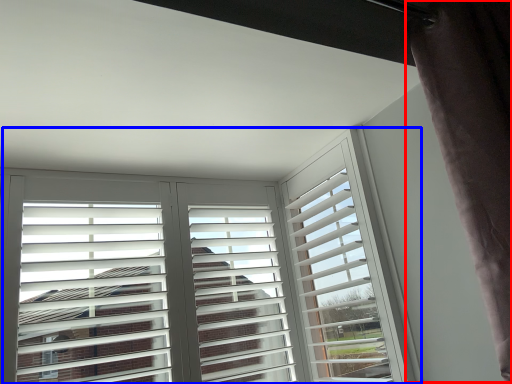
Question: Which object is closer to the camera taking this photo, curtain (highlighted by a red box) or window (highlighted by a blue box)?

Choices:
 (A) curtain
 (B) window

Answer: (A)